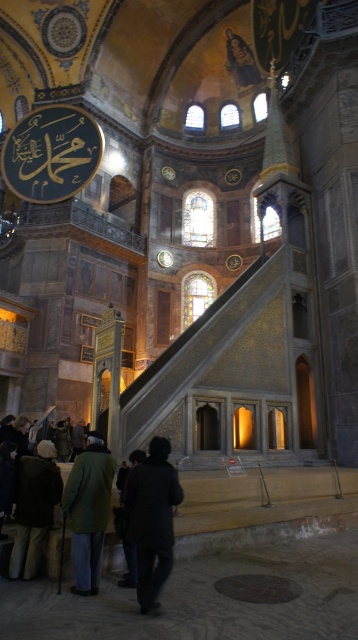
Who is positioned more to the left, dark gray coat at lower center or dark green jacket at lower left?

dark green jacket at lower left

Is dark gray coat at lower center smaller than dark green jacket at lower left?

No.

Identify the location of dark gray coat at lower center. pyautogui.click(x=152, y=518).

Between point (88, 445) and point (36, 467), which one is positioned behind?

The point (36, 467) is more distant.

Based on the photo, who is positioned more to the right, dark green coat at lower left or dark green jacket at lower left?

From the viewer's perspective, dark green coat at lower left appears more on the right side.

Image resolution: width=358 pixels, height=640 pixels. Find the location of `dark green coat at lower left`. dark green coat at lower left is located at coordinates (88, 509).

You are a GUI agent. You are given a task and a screenshot of the screen. Output one action in this format:
    pyautogui.click(x=<x>, y=<y>)
    Task: Click on the dark green coat at lower left
    
    Given the screenshot: What is the action you would take?
    pyautogui.click(x=88, y=509)

Who is more forward, (166, 545) or (76, 515)?

Point (166, 545)

Measure the distance between point (133, 492) and camera.

The distance of point (133, 492) from camera is 15.98 meters.

At what (x,y) coordinates should I click in order to perform the action: click on dark gray coat at lower center. Please return your answer as a coordinate pair (x, y). This screenshot has width=358, height=640. Looking at the image, I should click on (152, 518).

The height and width of the screenshot is (640, 358). What are the coordinates of `dark gray coat at lower center` in the screenshot? It's located at (152, 518).